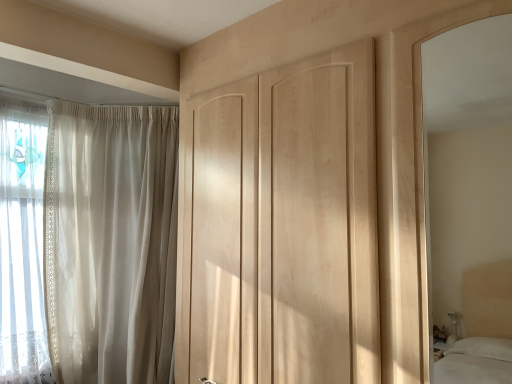
Find the location of a particular element. natural wood door at center is located at coordinates (282, 225).

The height and width of the screenshot is (384, 512). What are the coordinates of `door on the right of sheer white curtain at left` in the screenshot? It's located at (282, 225).

From a real-world perspective, is sheer white curtain at left on top of natural wood door at center?

No.

How distant is sheer white curtain at left from natural wood door at center?

sheer white curtain at left and natural wood door at center are 27.33 inches apart.

Considering the relative positions of sheer white curtain at left and natural wood door at center in the image provided, is sheer white curtain at left to the left or to the right of natural wood door at center?

From the image, it's evident that sheer white curtain at left is to the left of natural wood door at center.

Which point is more distant from viewer, (504, 162) or (134, 152)?

The point (504, 162) is farther.

Between light wood/matte mirror at right and sheer white curtain at left, which one has smaller size?

With smaller size is light wood/matte mirror at right.

Could you tell me if light wood/matte mirror at right is facing sheer white curtain at left?

No, light wood/matte mirror at right is not oriented towards sheer white curtain at left.

Find the location of a particular element. This screenshot has height=384, width=512. mirror located above the sheer white curtain at left (from a real-world perspective) is located at coordinates point(466,154).

Who is taller, natural wood door at center or sheer white curtain at left?

With more height is sheer white curtain at left.

I want to click on curtain located on the left of natural wood door at center, so click(111, 242).

From the image's perspective, which one is positioned lower, natural wood door at center or sheer white curtain at left?

sheer white curtain at left is shown below in the image.

Based on their positions, is natural wood door at center located to the left or right of sheer white curtain at left?

Based on their positions, natural wood door at center is located to the right of sheer white curtain at left.

Considering the sizes of objects natural wood door at center and light wood/matte mirror at right in the image provided, who is shorter, natural wood door at center or light wood/matte mirror at right?

Standing shorter between the two is light wood/matte mirror at right.

Is point (289, 380) farther from viewer compared to point (449, 198)?

No, it is not.

Relative to light wood/matte mirror at right, is natural wood door at center in front or behind?

In the image, natural wood door at center appears behind light wood/matte mirror at right.

Is sheer white curtain at left aimed at light wood/matte mirror at right?

No, sheer white curtain at left is not facing towards light wood/matte mirror at right.

Consider the image. Between sheer white curtain at left and light wood/matte mirror at right, which one is positioned behind?

sheer white curtain at left is further away from the camera.

Measure the distance between sheer white curtain at left and light wood/matte mirror at right.

sheer white curtain at left and light wood/matte mirror at right are 2.49 meters apart.

From a real-world perspective, is sheer white curtain at left physically below light wood/matte mirror at right?

Yes.

Is natural wood door at center a part of light wood/matte mirror at right?

No, natural wood door at center is not a part of light wood/matte mirror at right.

The width and height of the screenshot is (512, 384). I want to click on door that is under the light wood/matte mirror at right (from a real-world perspective), so click(282, 225).

Is light wood/matte mirror at right oriented away from natural wood door at center?

light wood/matte mirror at right is not turned away from natural wood door at center.

Between light wood/matte mirror at right and natural wood door at center, which one has larger size?

natural wood door at center.

Locate an element on the screen. The width and height of the screenshot is (512, 384). curtain located behind the natural wood door at center is located at coordinates (111, 242).

Find the location of `mirror to the right of sheer white curtain at left`. mirror to the right of sheer white curtain at left is located at coordinates (466, 154).

Which object lies nearer to the anchor point natural wood door at center, light wood/matte mirror at right or sheer white curtain at left?

The object closer to natural wood door at center is sheer white curtain at left.

From the image, which object appears to be farther from light wood/matte mirror at right, natural wood door at center or sheer white curtain at left?

sheer white curtain at left is further to light wood/matte mirror at right.

Considering their positions, is light wood/matte mirror at right positioned closer to sheer white curtain at left than natural wood door at center?

natural wood door at center is positioned closer to the anchor sheer white curtain at left.

Looking at the image, which one is located closer to natural wood door at center, sheer white curtain at left or light wood/matte mirror at right?

Among the two, sheer white curtain at left is located nearer to natural wood door at center.

Based on their spatial positions, is natural wood door at center or light wood/matte mirror at right closer to sheer white curtain at left?

natural wood door at center is positioned closer to the anchor sheer white curtain at left.

Which object lies further to the anchor point light wood/matte mirror at right, sheer white curtain at left or natural wood door at center?

sheer white curtain at left lies further to light wood/matte mirror at right than the other object.

The width and height of the screenshot is (512, 384). I want to click on door between sheer white curtain at left and light wood/matte mirror at right, so click(282, 225).